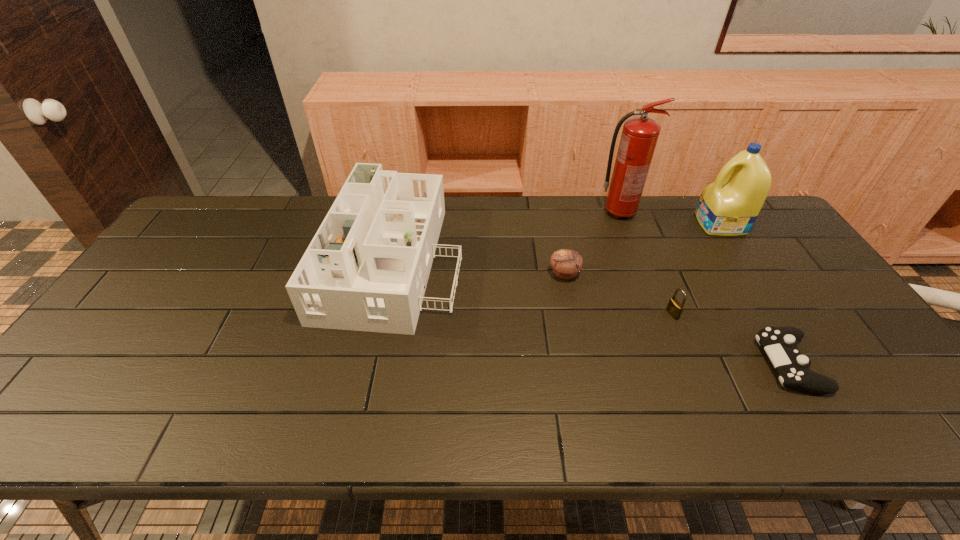
Locate an element on the screen. The image size is (960, 540). free point between the padlock and the fifth shortest object is located at coordinates (696, 269).

Identify the location of vacant space that's between the shortest object and the leftmost object. The height and width of the screenshot is (540, 960). (592, 310).

I want to click on blank region between the fifth object from right to left and the padlock, so click(x=618, y=294).

Find the location of a particular element. This screenshot has height=540, width=960. free space that is in between the fire extinguisher and the shortest object is located at coordinates (704, 288).

Image resolution: width=960 pixels, height=540 pixels. I want to click on vacant area that lies between the second object from left to right and the third tallest object, so click(x=480, y=265).

Locate an element on the screen. This screenshot has height=540, width=960. unoccupied position between the second object from left to right and the padlock is located at coordinates (618, 294).

Find the location of a particular element. This screenshot has height=540, width=960. free spot between the muffin and the padlock is located at coordinates (618, 294).

Select which object appears as the second closest to the padlock. Please provide its 2D coordinates. Your answer should be formatted as a tuple, i.e. [(x, y)], where the tuple contains the x and y coordinates of a point satisfying the conditions above.

[(566, 263)]

Identify which object is the second nearest to the fifth shortest object. Please provide its 2D coordinates. Your answer should be formatted as a tuple, i.e. [(x, y)], where the tuple contains the x and y coordinates of a point satisfying the conditions above.

[(674, 308)]

You are a GUI agent. You are given a task and a screenshot of the screen. Output one action in this format:
    pyautogui.click(x=<x>, y=<y>)
    Task: Click on the vacant region that satisfies the following two spatial constraints: 1. on the label of the detergent; 2. on the front side of the padlock
    The image size is (960, 540).
    Given the screenshot: What is the action you would take?
    click(x=778, y=314)